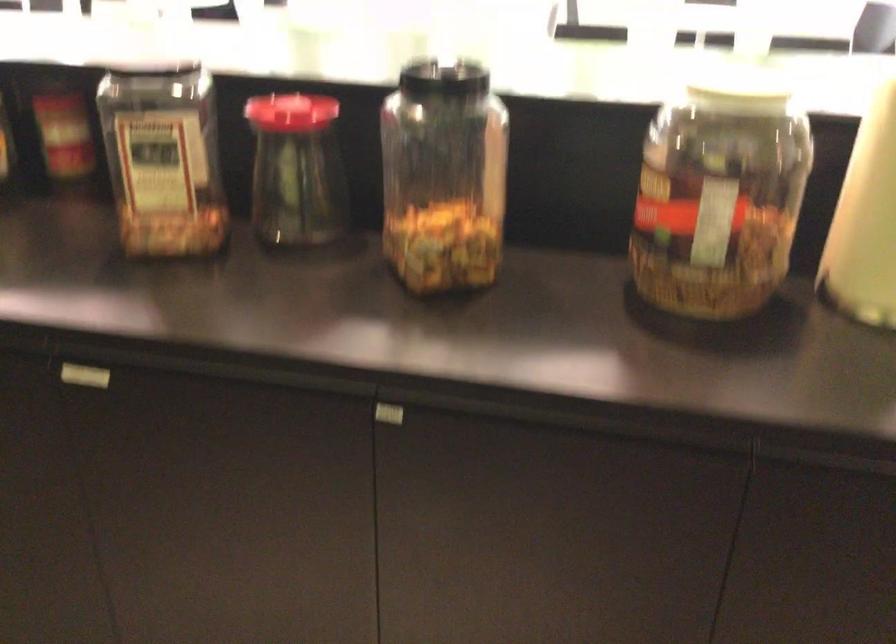
The width and height of the screenshot is (896, 644). What are the coordinates of `white jar lid` in the screenshot? It's located at (739, 91).